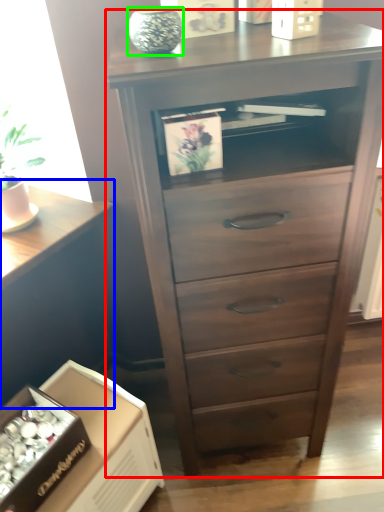
Question: Which object is positioned farthest from chest of drawers (highlighted by a red box)? Select from table (highlighted by a blue box) and glass vase (highlighted by a green box).

Choices:
 (A) table
 (B) glass vase

Answer: (A)